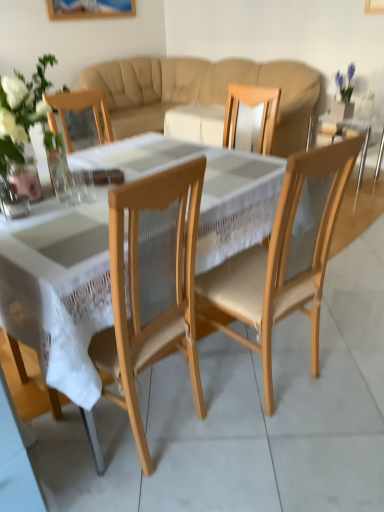
Identify the location of free point behind transparent glass at center, which is counted as the first tableware, starting from the right. This screenshot has height=512, width=384. (89, 188).